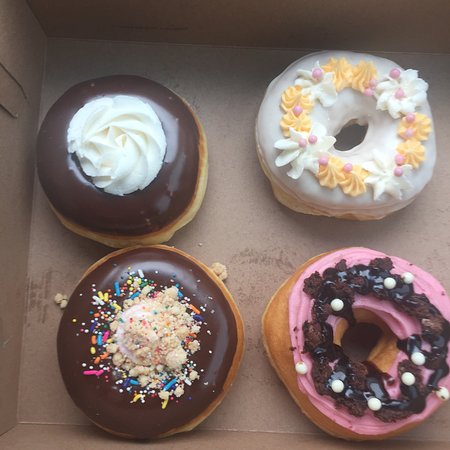
Locate an element on the screen. carboard box is located at coordinates (243, 228).